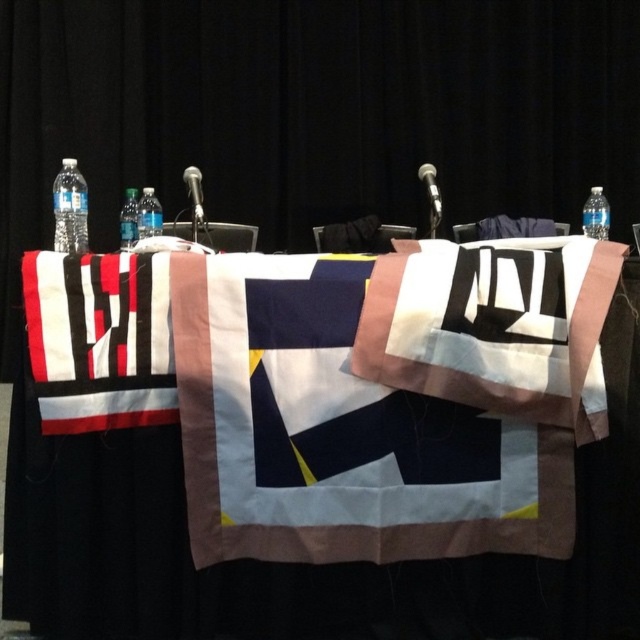
Is metallic silver microphone at upper center behind matte black microphone at center?

Yes, metallic silver microphone at upper center is further from the viewer.

In the scene shown: Between metallic silver microphone at upper center and matte black microphone at center, which one is positioned higher?

metallic silver microphone at upper center

Locate an element on the screen. This screenshot has width=640, height=640. metallic silver microphone at upper center is located at coordinates (432, 192).

I want to click on metallic silver microphone at upper center, so click(x=432, y=192).

Does clear plastic bottle at upper left have a larger size compared to matte black microphone at center?

No.

Which is above, clear plastic bottle at upper left or matte black microphone at center?

matte black microphone at center is above.

What do you see at coordinates (148, 214) in the screenshot? The image size is (640, 640). I see `clear plastic bottle at upper left` at bounding box center [148, 214].

I want to click on clear plastic bottle at upper left, so click(148, 214).

Is clear plastic bottle at left below clear plastic bottle at upper left?

Correct, clear plastic bottle at left is located below clear plastic bottle at upper left.

Is clear plastic bottle at left wider than clear plastic bottle at upper left?

Correct, the width of clear plastic bottle at left exceeds that of clear plastic bottle at upper left.

This screenshot has width=640, height=640. What do you see at coordinates (68, 209) in the screenshot?
I see `clear plastic bottle at left` at bounding box center [68, 209].

The height and width of the screenshot is (640, 640). Find the location of `clear plastic bottle at left`. clear plastic bottle at left is located at coordinates (68, 209).